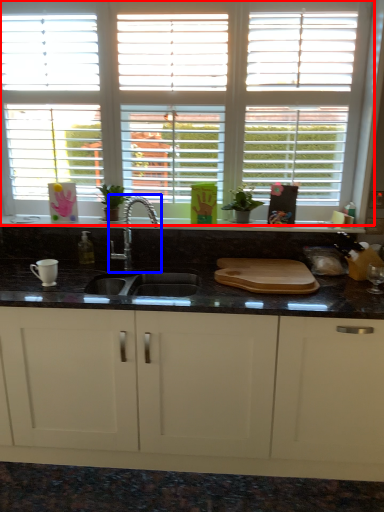
Question: Which point is further to the camera, window (highlighted by a red box) or tap (highlighted by a blue box)?

Choices:
 (A) window
 (B) tap

Answer: (A)